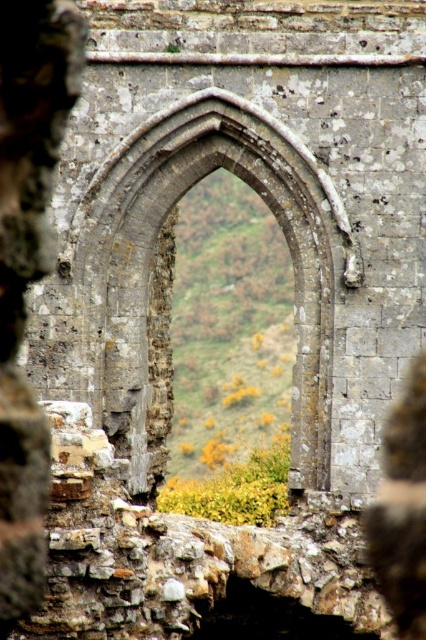
Is stone archway at center closer to the viewer compared to smooth stone wall at center?

That is False.

Which is more to the right, stone archway at center or smooth stone wall at center?

smooth stone wall at center is more to the right.

Based on the photo, who is more distant from viewer, (147, 163) or (400, 460)?

The point (147, 163) is behind.

Locate an element on the screen. Image resolution: width=426 pixels, height=640 pixels. stone archway at center is located at coordinates (152, 244).